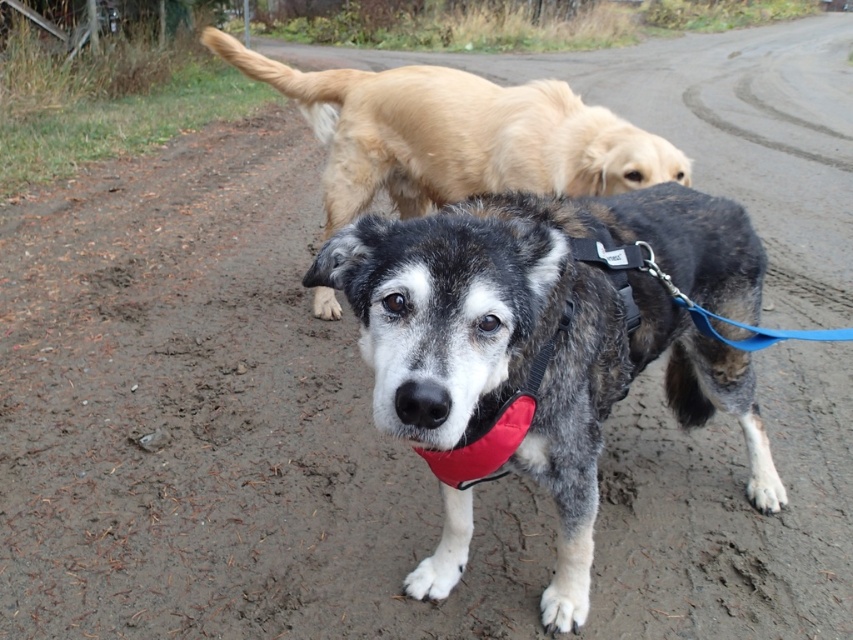
Who is more forward, [469,230] or [653,182]?

Point [469,230] is in front.

Does speckled fur dog at center have a lesser width compared to golden fur dog at upper center?

Correct, speckled fur dog at center's width is less than golden fur dog at upper center's.

Which is behind, point (521, 296) or point (463, 166)?

The point (463, 166) is more distant.

Locate an element on the screen. This screenshot has width=853, height=640. speckled fur dog at center is located at coordinates (550, 333).

Is golden fur dog at upper center smaller than red fabric neckband at center?

No, golden fur dog at upper center is not smaller than red fabric neckband at center.

Measure the distance from golden fur dog at upper center to red fabric neckband at center.

1.81 meters

Is point (428, 192) positioned before point (534, 403)?

No, it is not.

Locate an element on the screen. This screenshot has height=640, width=853. golden fur dog at upper center is located at coordinates (456, 134).

Between speckled fur dog at center and red fabric neckband at center, which one appears on the left side from the viewer's perspective?

red fabric neckband at center is more to the left.

Does speckled fur dog at center have a larger size compared to red fabric neckband at center?

Correct, speckled fur dog at center is larger in size than red fabric neckband at center.

You are a GUI agent. You are given a task and a screenshot of the screen. Output one action in this format:
    pyautogui.click(x=<x>, y=<y>)
    Task: Click on the speckled fur dog at center
    
    Given the screenshot: What is the action you would take?
    click(x=550, y=333)

Image resolution: width=853 pixels, height=640 pixels. In order to click on speckled fur dog at center in this screenshot , I will do `click(550, 333)`.